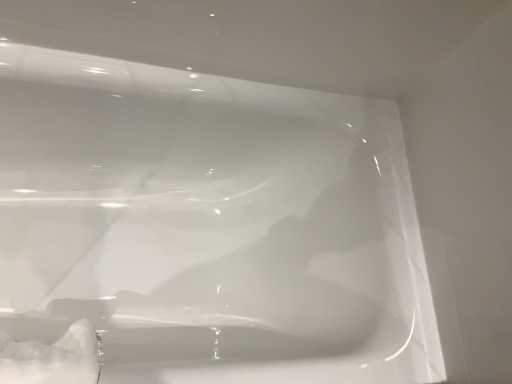
Question: Should I look upward or downward to see white textured foam at lower left?

Choices:
 (A) up
 (B) down

Answer: (B)